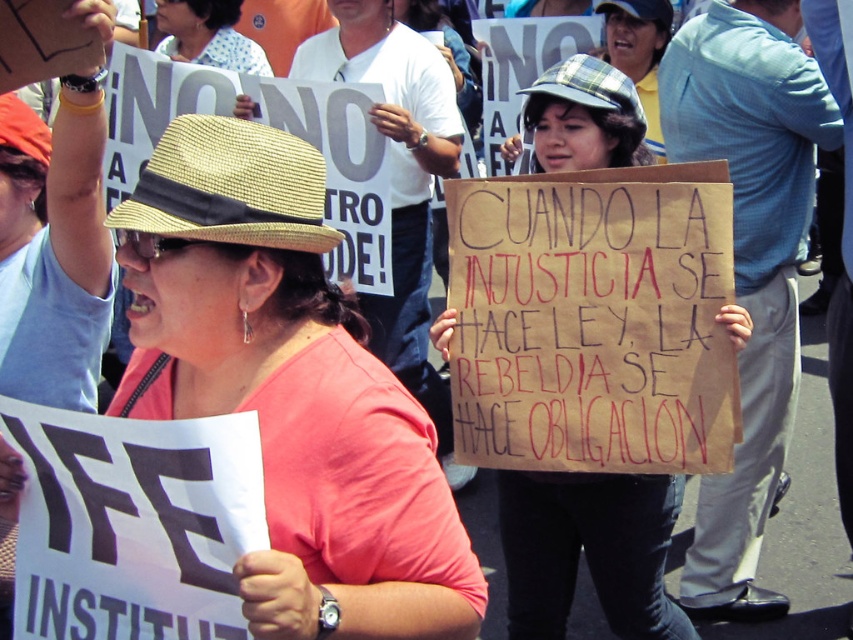
Question: Does matte straw hat at center have a greater width compared to plaid fabric hat at center?

Choices:
 (A) no
 (B) yes

Answer: (B)

Question: Can you confirm if matte straw hat at center is positioned below plaid fabric hat at center?

Choices:
 (A) no
 (B) yes

Answer: (A)

Question: Which object appears farthest from the camera in this image?

Choices:
 (A) matte straw hat at center
 (B) plaid fabric hat at center

Answer: (B)

Question: Which point is closer to the camera taking this photo?

Choices:
 (A) (292, 147)
 (B) (570, 128)

Answer: (A)

Question: Can you confirm if matte straw hat at center is smaller than plaid fabric hat at center?

Choices:
 (A) no
 (B) yes

Answer: (A)